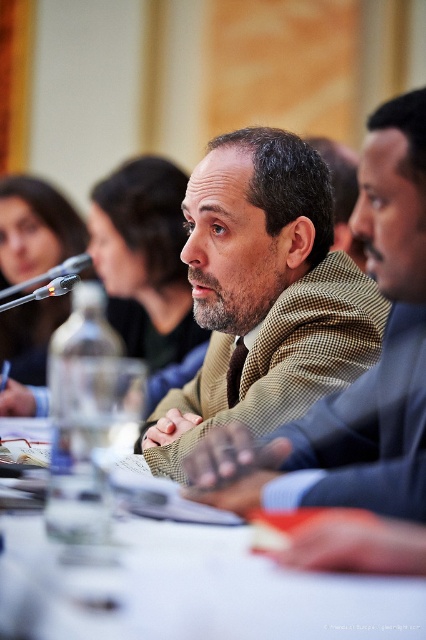
You are attending a professional meeting and notice the green checkered blazer at center and the white glossy table at center. Which object is taller?

The green checkered blazer at center is taller than the white glossy table at center.

You are standing in front of the table where the green checkered blazer at center is placed. You want to reach into your pocket to grab your phone without moving your hands from your current position. Can you do this if your arms can reach 3 feet?

The green checkered blazer at center is 4.23 feet from camera, which is farther than your 3 feet reach. Therefore, you cannot reach it without moving closer.

You are sitting at the table in the image and want to reach both the point at coordinates point (189, 243) and point (203, 541). Which point will require you to reach further away from your body?

Point (203, 541) will require reaching further away from your body because it is closer to the back of the table and farther from the viewer compared to point (189, 243).